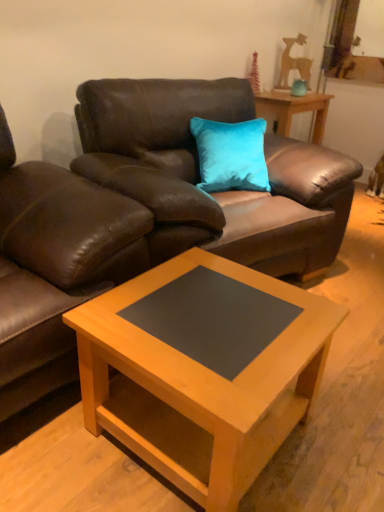
Question: Can you confirm if wooden table at center is smaller than brown leather swivel chair at left?

Choices:
 (A) yes
 (B) no

Answer: (A)

Question: From the image's perspective, is wooden table at center over brown leather swivel chair at left?

Choices:
 (A) yes
 (B) no

Answer: (A)

Question: Could you tell me if wooden table at center is facing brown leather swivel chair at left?

Choices:
 (A) yes
 (B) no

Answer: (B)

Question: Can you confirm if wooden table at center is positioned to the right of brown leather swivel chair at left?

Choices:
 (A) yes
 (B) no

Answer: (A)

Question: Are wooden table at center and brown leather swivel chair at left located far from each other?

Choices:
 (A) yes
 (B) no

Answer: (A)

Question: Considering the positions of point (317, 95) and point (297, 96), is point (317, 95) closer or farther from the camera than point (297, 96)?

Choices:
 (A) farther
 (B) closer

Answer: (A)

Question: In terms of width, does wooden table at center look wider or thinner when compared to teal velvet vase at upper right?

Choices:
 (A) wide
 (B) thin

Answer: (A)

Question: Visually, is wooden table at center positioned to the left or to the right of teal velvet vase at upper right?

Choices:
 (A) left
 (B) right

Answer: (A)

Question: From a real-world perspective, is wooden table at center positioned above or below teal velvet vase at upper right?

Choices:
 (A) above
 (B) below

Answer: (B)

Question: Based on their positions, is brown leather swivel chair at left located to the left or right of light wood/black laminate coffee table at center?

Choices:
 (A) right
 (B) left

Answer: (B)

Question: In terms of height, does brown leather swivel chair at left look taller or shorter compared to light wood/black laminate coffee table at center?

Choices:
 (A) tall
 (B) short

Answer: (A)

Question: Is brown leather swivel chair at left inside the boundaries of light wood/black laminate coffee table at center, or outside?

Choices:
 (A) outside
 (B) inside

Answer: (A)

Question: From the image's perspective, is brown leather swivel chair at left positioned above or below light wood/black laminate coffee table at center?

Choices:
 (A) above
 (B) below

Answer: (A)

Question: From the image's perspective, is brown leather couch at upper center above or below light wood/black laminate coffee table at center?

Choices:
 (A) below
 (B) above

Answer: (B)

Question: Looking at the image, does brown leather couch at upper center seem bigger or smaller compared to light wood/black laminate coffee table at center?

Choices:
 (A) small
 (B) big

Answer: (B)